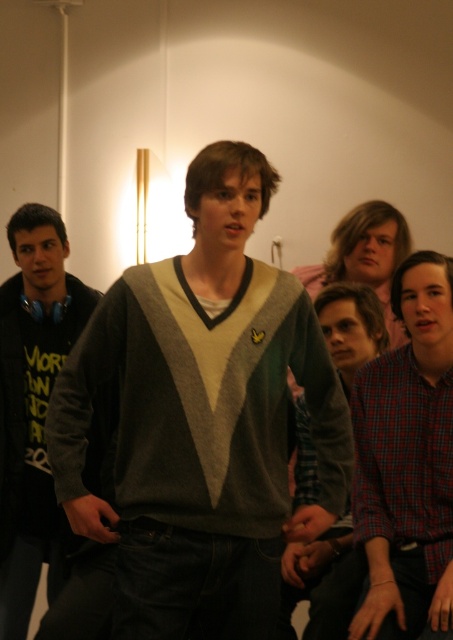
Question: Can you confirm if knit sweater at center is thinner than black matte hoodie at left?

Choices:
 (A) yes
 (B) no

Answer: (B)

Question: Which object is the closest to the knit sweater at center?

Choices:
 (A) black matte hoodie at left
 (B) plaid shirt at center

Answer: (B)

Question: Which point appears farthest from the camera in this image?

Choices:
 (A) (46, 384)
 (B) (83, 426)

Answer: (A)

Question: Among these objects, which one is farthest from the camera?

Choices:
 (A) plaid shirt at center
 (B) black matte hoodie at left

Answer: (B)

Question: Can you confirm if knit sweater at center is positioned above plaid shirt at center?

Choices:
 (A) yes
 (B) no

Answer: (A)

Question: Observing the image, what is the correct spatial positioning of plaid shirt at center in reference to black matte hoodie at left?

Choices:
 (A) right
 (B) left

Answer: (A)